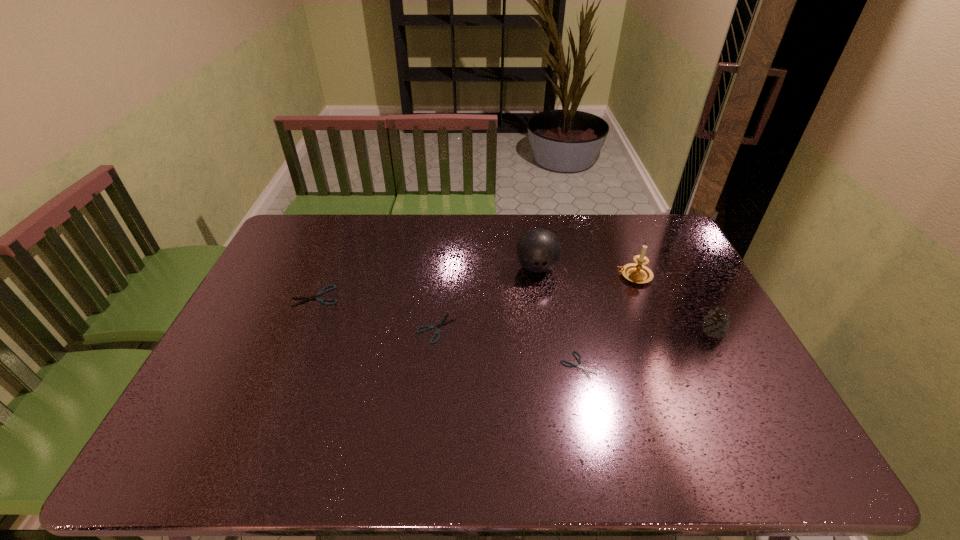
Where is `free space that satisfies the following two spatial constraints: 1. with a handle on the side of the pinecone; 2. on the left side of the second object from right to left`? Image resolution: width=960 pixels, height=540 pixels. free space that satisfies the following two spatial constraints: 1. with a handle on the side of the pinecone; 2. on the left side of the second object from right to left is located at coordinates (656, 332).

The width and height of the screenshot is (960, 540). I want to click on vacant area that satisfies the following two spatial constraints: 1. on the grip area of the pinecone; 2. on the right side of the bowling ball, so click(x=546, y=332).

Identify the location of vacant space that satisfies the following two spatial constraints: 1. on the front side of the second farthest shears; 2. on the left side of the leftmost shears. (302, 328).